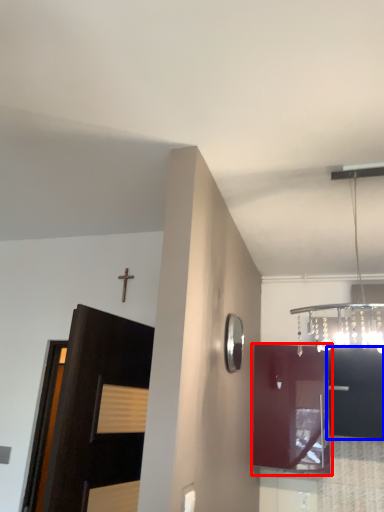
Question: Which of the following is the closest to the observer, cabinetry (highlighted by a red box) or cabinetry (highlighted by a blue box)?

Choices:
 (A) cabinetry
 (B) cabinetry

Answer: (B)